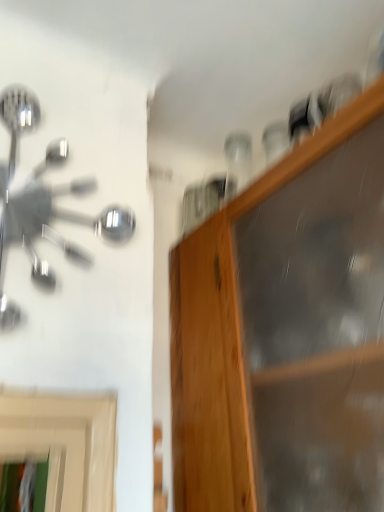
Measure the distance between polished metal utensils at upper left and camera.

They are 23.12 inches apart.

What is the approximate height of polished metal utensils at upper left?

polished metal utensils at upper left is 22.33 inches tall.

The image size is (384, 512). Find the location of `polished metal utensils at upper left`. polished metal utensils at upper left is located at coordinates (43, 201).

The width and height of the screenshot is (384, 512). Describe the element at coordinates (43, 201) in the screenshot. I see `polished metal utensils at upper left` at that location.

Locate an element on the screen. polished metal utensils at upper left is located at coordinates (43, 201).